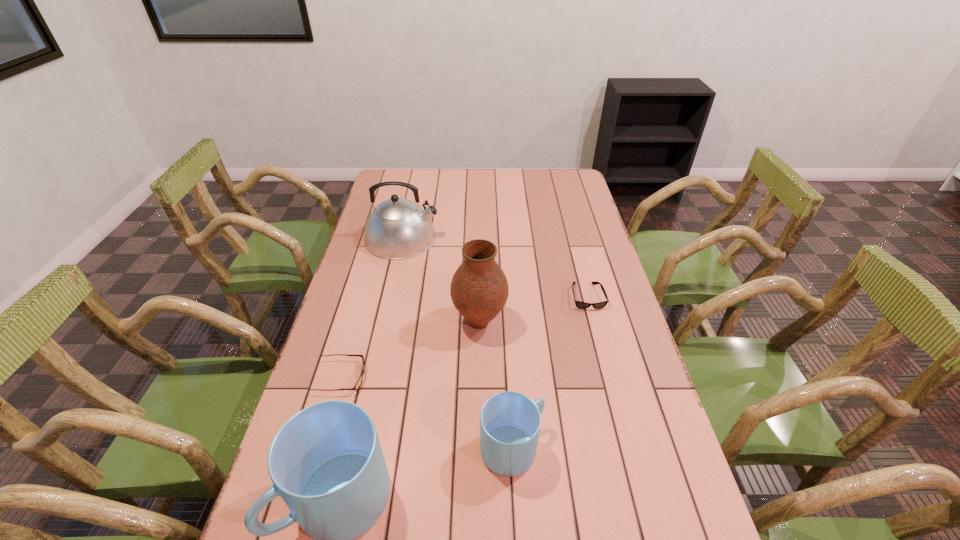
At what (x,y) coordinates should I click in order to perform the action: click on the third shortest object. Please return your answer as a coordinate pair (x, y). The height and width of the screenshot is (540, 960). Looking at the image, I should click on (510, 422).

Identify the location of the shorter mug. This screenshot has width=960, height=540. (510, 422).

The image size is (960, 540). Identify the location of vase. (479, 289).

In order to click on kettle in this screenshot , I will do `click(398, 228)`.

Identify the location of the farther sunglasses. The height and width of the screenshot is (540, 960). pyautogui.click(x=579, y=304).

Where is `the rightmost object`? the rightmost object is located at coordinates coord(579,304).

Identify the location of the left sunglasses. (356, 387).

Locate an element on the screen. The height and width of the screenshot is (540, 960). the fourth farthest object is located at coordinates (356, 387).

Find the location of a particular element. free space located 0.380m on the back of the fourth tallest object is located at coordinates (504, 312).

At what (x,y) coordinates should I click in order to perform the action: click on vacant area located 0.280m on the left of the vase. Please return your answer as a coordinate pair (x, y). Looking at the image, I should click on (360, 323).